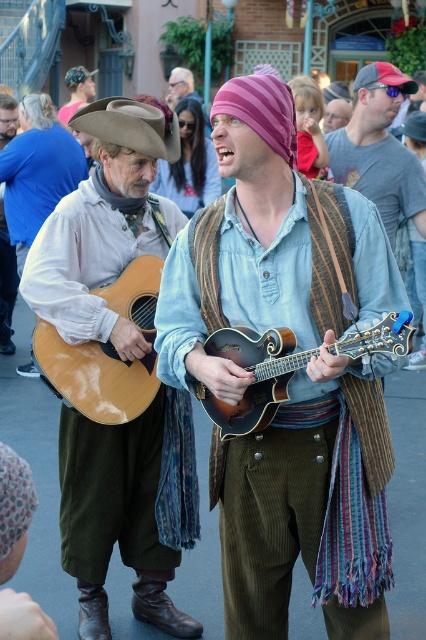
You are a photographer trying to capture a clear shot of both the glossy wood guitar at left and the wooden mandolin at center. Since you want both instruments to be visible in your photo, can you adjust your camera angle so that neither instrument blocks the other?

The glossy wood guitar at left is positioned over the wooden mandolin at center, so adjusting the camera angle to shoot from a lower or higher perspective might help avoid blocking either instrument.

You are a photographer standing at the center of the street where the performance is happening. You want to take a photo that includes both the point at coordinates point (x=155, y=380) and point (x=230, y=352). Which point should you focus on first to ensure both are in focus?

You should focus on point (x=155, y=380) first because it is closer to you than point (x=230, y=352), ensuring both points are within the depth of field.